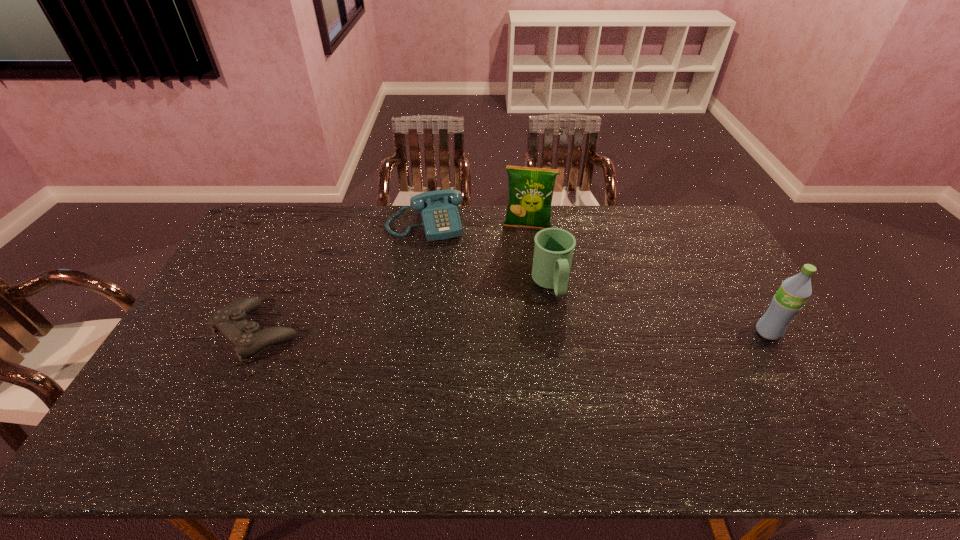
Image resolution: width=960 pixels, height=540 pixels. What are the coordinates of `object present at the left edge` in the screenshot? It's located at (246, 337).

Identify the location of object that is at the right edge. The image size is (960, 540). (793, 293).

This screenshot has height=540, width=960. Find the location of `free space at the far edge`. free space at the far edge is located at coordinates (595, 205).

Find the location of a particular element. Image resolution: width=960 pixels, height=540 pixels. vacant region at the near edge of the desktop is located at coordinates (313, 387).

In the image, there is a desktop. Identify the location of vacant space at the right edge. The height and width of the screenshot is (540, 960). (751, 336).

Find the location of a particular element. Image resolution: width=960 pixels, height=540 pixels. unoccupied area between the mug and the leftmost object is located at coordinates (404, 308).

Where is `vacant area between the second shortest object and the rightmost object`? The width and height of the screenshot is (960, 540). vacant area between the second shortest object and the rightmost object is located at coordinates (596, 278).

Where is `free space between the leftmost object and the mug`? The image size is (960, 540). free space between the leftmost object and the mug is located at coordinates (404, 308).

Identify the location of vacant area between the water bottle and the leftmost object. (513, 332).

Find the location of a particular element. unoccupied position between the crisp (potato chip) and the rightmost object is located at coordinates (648, 279).